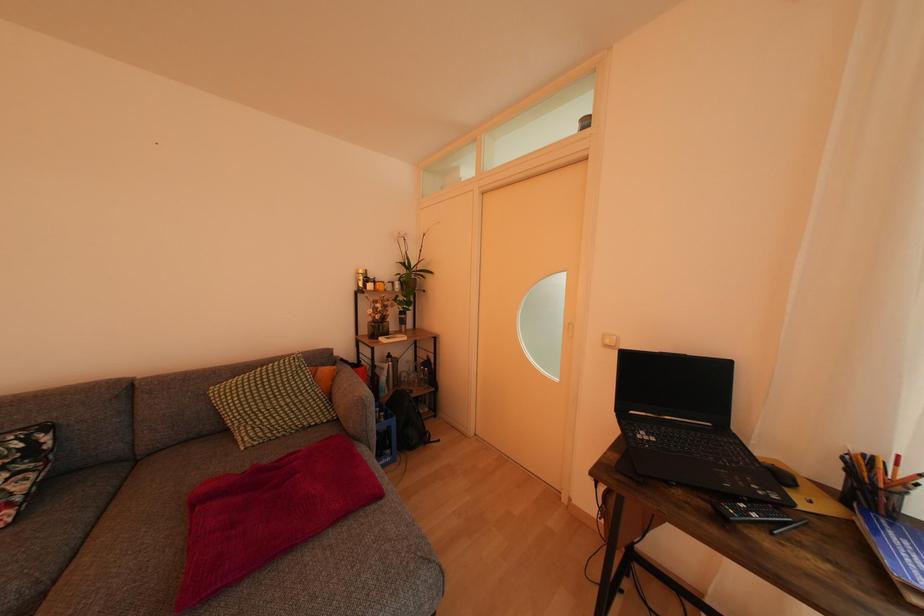
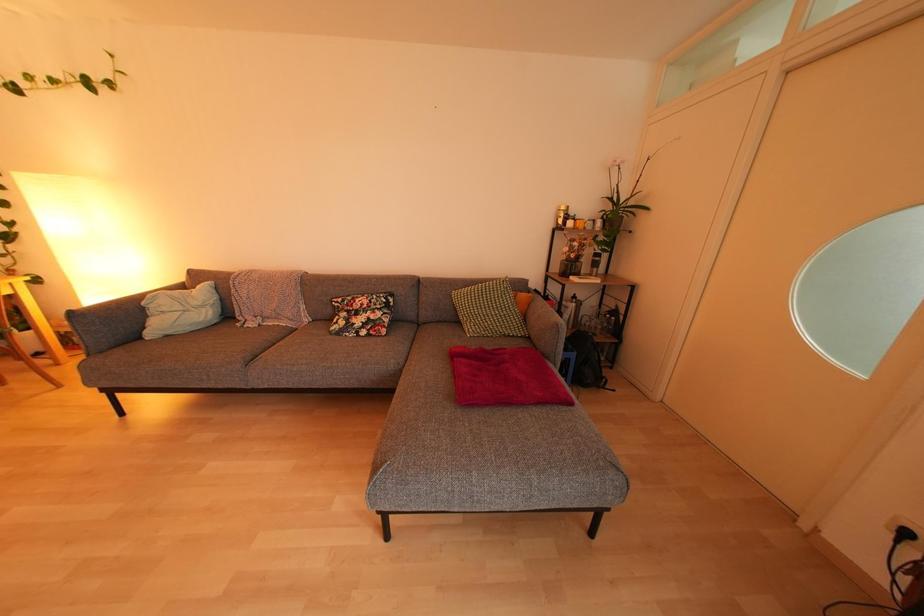
Question: The camera is either moving clockwise (left) or counter-clockwise (right) around the object. The first image is from the beginning of the video and the second image is from the end. Is the camera moving left or right when shooting the video?

Choices:
 (A) Left
 (B) Right

Answer: (B)